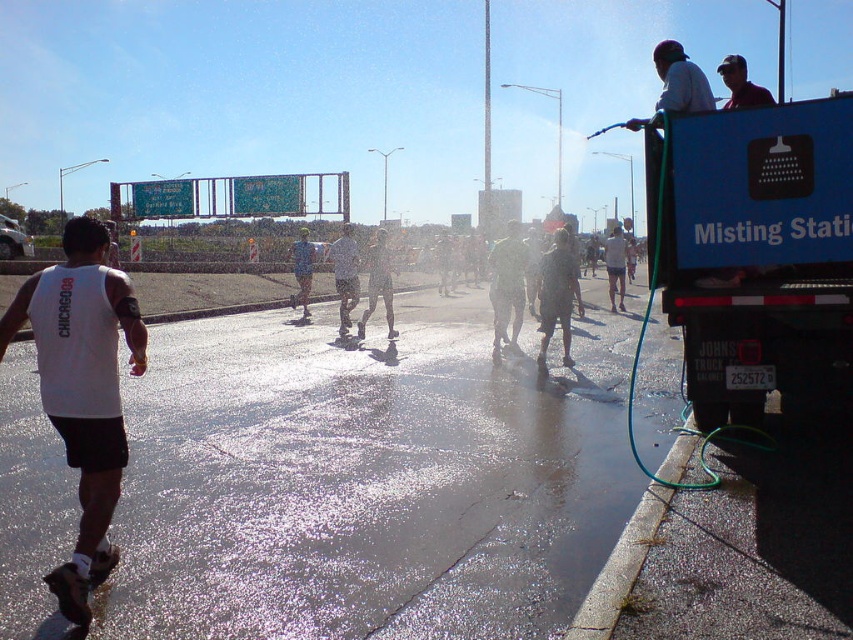
Is point (846, 252) closer to camera compared to point (59, 602)?

No, (846, 252) is behind (59, 602).

Between point (706, 189) and point (115, 305), which one is positioned in front?

Positioned in front is point (115, 305).

This screenshot has height=640, width=853. What are the coordinates of `blue plastic truck at right` in the screenshot? It's located at (755, 252).

Which is behind, point (55, 305) or point (741, 92)?

Point (741, 92)

Between point (143, 355) and point (741, 80), which one is positioned in front?

Point (143, 355)

Where is `white matte tank top at left`? white matte tank top at left is located at coordinates tap(82, 388).

Is green camouflage pants at center positioned in front of white matte shorts at center?

Yes.

Is green camouflage pants at center smaller than white matte shorts at center?

Yes.

The height and width of the screenshot is (640, 853). Describe the element at coordinates (508, 284) in the screenshot. I see `green camouflage pants at center` at that location.

Identify the location of green camouflage pants at center. (508, 284).